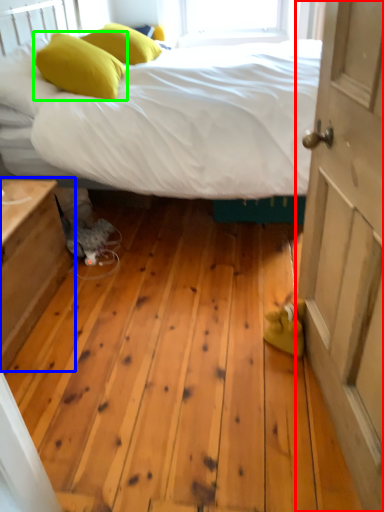
Question: Estimate the real-world distances between objects in this image. Which object is farther from door (highlighted by a red box), nightstand (highlighted by a blue box) or pillow (highlighted by a green box)?

Choices:
 (A) nightstand
 (B) pillow

Answer: (B)